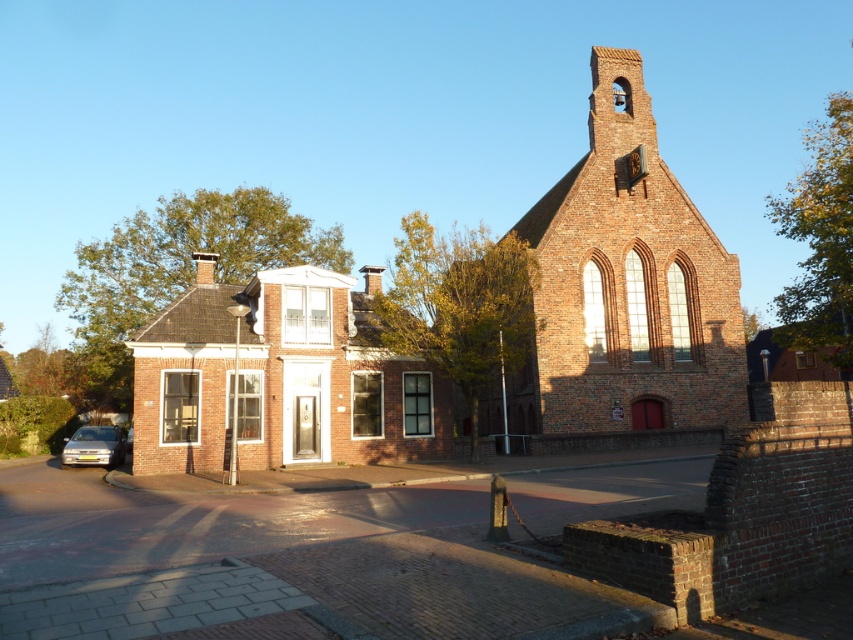
Question: Does brick church at center come in front of brick house at center?

Choices:
 (A) no
 (B) yes

Answer: (A)

Question: Can you confirm if brick house at center is thinner than silver metallic car at lower left?

Choices:
 (A) no
 (B) yes

Answer: (A)

Question: Which of the following is the farthest from the observer?

Choices:
 (A) tap(265, 433)
 (B) tap(105, 435)
 (C) tap(605, 244)

Answer: (C)

Question: Does brick house at center have a lesser width compared to silver metallic car at lower left?

Choices:
 (A) no
 (B) yes

Answer: (A)

Question: Estimate the real-world distances between objects in this image. Which object is farther from the brick church at center?

Choices:
 (A) brick house at center
 (B) silver metallic car at lower left

Answer: (B)

Question: Considering the real-world distances, which object is farthest from the brick house at center?

Choices:
 (A) silver metallic car at lower left
 (B) brick church at center

Answer: (B)